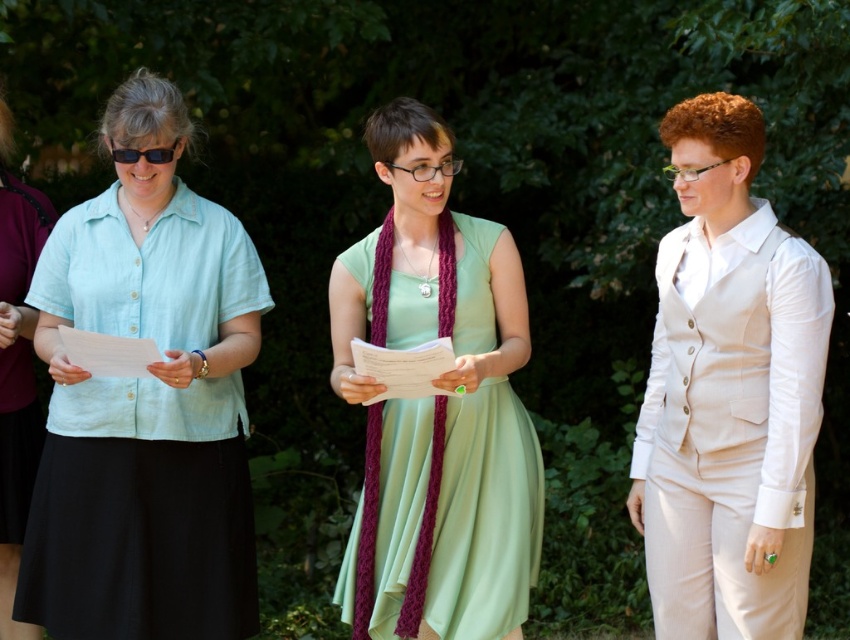
Who is positioned more to the right, matte light blue blouse at left or black plastic goggles at left?

black plastic goggles at left is more to the right.

Is point (7, 193) closer to camera compared to point (162, 147)?

No, it is behind (162, 147).

This screenshot has height=640, width=850. What do you see at coordinates (17, 371) in the screenshot?
I see `matte light blue blouse at left` at bounding box center [17, 371].

Where is `matte light blue blouse at left`? matte light blue blouse at left is located at coordinates pos(17,371).

Who is positioned more to the right, matte light blue shirt at left or matte light blue blouse at left?

Positioned to the right is matte light blue shirt at left.

Is the position of matte light blue shirt at left less distant than that of matte light blue blouse at left?

That is True.

Does point (251, 321) come behind point (26, 310)?

That is False.

Locate an element on the screen. Image resolution: width=850 pixels, height=640 pixels. matte light blue shirt at left is located at coordinates (145, 403).

Who is taller, matte light blue shirt at left or black plastic goggles at left?

matte light blue shirt at left is taller.

Which is above, matte light blue shirt at left or black plastic goggles at left?

black plastic goggles at left is above.

Who is more forward, (95,595) or (131,148)?

Point (131,148)

Locate an element on the screen. matte light blue shirt at left is located at coordinates (145, 403).